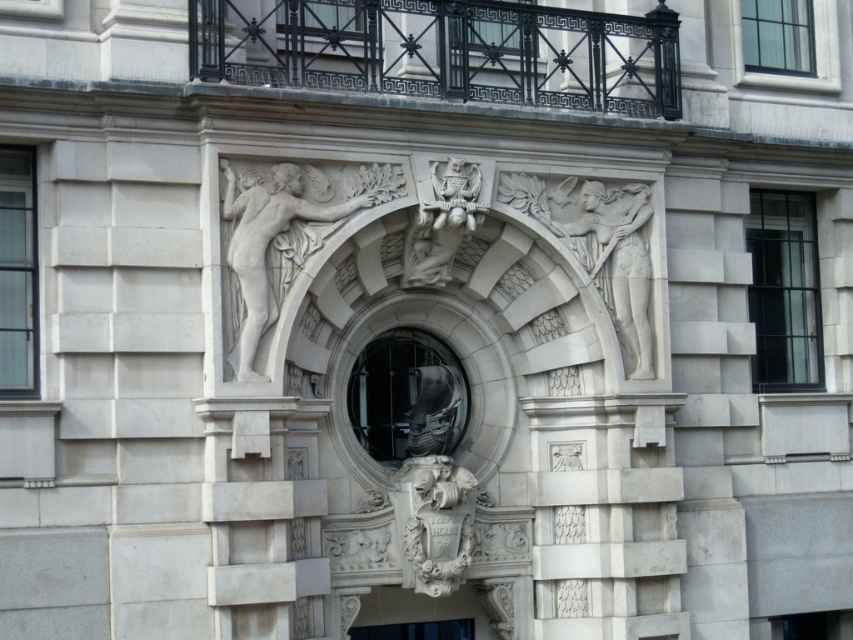
Question: Which point is farther to the camera?

Choices:
 (A) white marble cherub at upper left
 (B) white stone coat of arms at center
 (C) white stone statue at center
 (D) white stone relief at upper right

Answer: (C)

Question: Does white marble cherub at upper left have a larger size compared to white stone relief at upper right?

Choices:
 (A) yes
 (B) no

Answer: (A)

Question: Which of the following is the closest to the observer?

Choices:
 (A) white stone coat of arms at center
 (B) white marble cherub at upper left
 (C) white stone statue at center

Answer: (B)

Question: Is white stone relief at upper right below white stone eagle at center?

Choices:
 (A) no
 (B) yes

Answer: (B)

Question: Which point is closer to the camera?

Choices:
 (A) (x=416, y=477)
 (B) (x=431, y=634)

Answer: (A)

Question: Is white marble cherub at upper left positioned at the back of white stone relief at upper right?

Choices:
 (A) no
 (B) yes

Answer: (A)